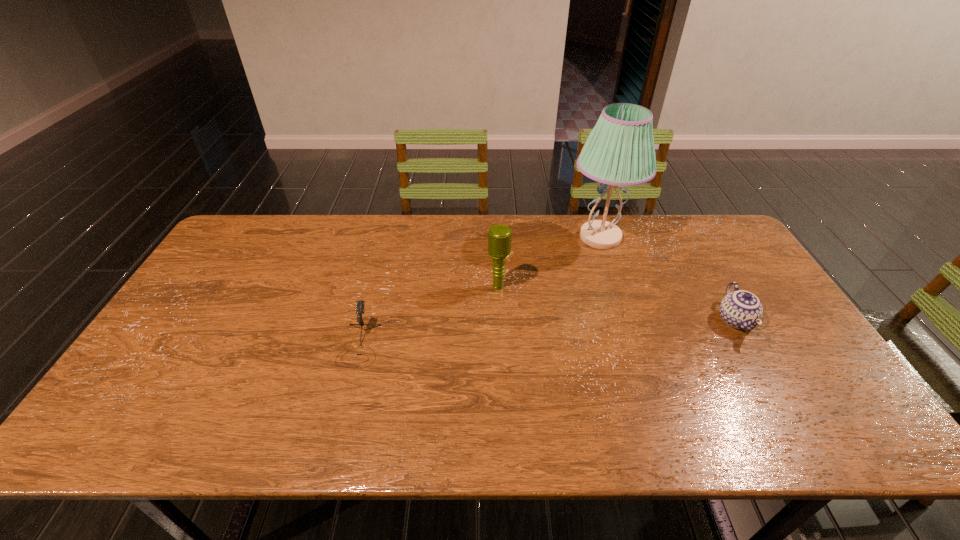
Where is `vacant area that lies between the rightmost object and the third object from left to right`? The height and width of the screenshot is (540, 960). vacant area that lies between the rightmost object and the third object from left to right is located at coordinates [x=667, y=279].

At what (x,y) coordinates should I click in order to perform the action: click on vacant area between the rightmost object and the right microphone. Please return your answer as a coordinate pair (x, y). Looking at the image, I should click on (616, 303).

Where is `free area in between the third object from left to right and the leftmost object`? This screenshot has height=540, width=960. free area in between the third object from left to right and the leftmost object is located at coordinates (480, 291).

The height and width of the screenshot is (540, 960). Find the location of `free spot between the left microphone and the taller microphone`. free spot between the left microphone and the taller microphone is located at coordinates (429, 315).

Where is `vacant region between the third object from left to right and the second tallest object`? The height and width of the screenshot is (540, 960). vacant region between the third object from left to right and the second tallest object is located at coordinates (549, 262).

Find the location of a particular element. The height and width of the screenshot is (540, 960). blank region between the third object from right to left and the leftmost object is located at coordinates (429, 315).

At what (x,y) coordinates should I click in order to perform the action: click on free area in between the shorter microphone and the tallest object. Please return your answer as a coordinate pair (x, y). This screenshot has height=540, width=960. Looking at the image, I should click on (480, 291).

At what (x,y) coordinates should I click in order to perform the action: click on free space between the farther microphone and the leftmost object. Please return your answer as a coordinate pair (x, y). The height and width of the screenshot is (540, 960). Looking at the image, I should click on (429, 315).

Locate which object ranks in proximity to the rightmost object. Please provide its 2D coordinates. Your answer should be formatted as a tuple, i.e. [(x, y)], where the tuple contains the x and y coordinates of a point satisfying the conditions above.

[(619, 151)]

Locate which object ranks in proximity to the lamp. Please provide its 2D coordinates. Your answer should be formatted as a tuple, i.e. [(x, y)], where the tuple contains the x and y coordinates of a point satisfying the conditions above.

[(741, 309)]